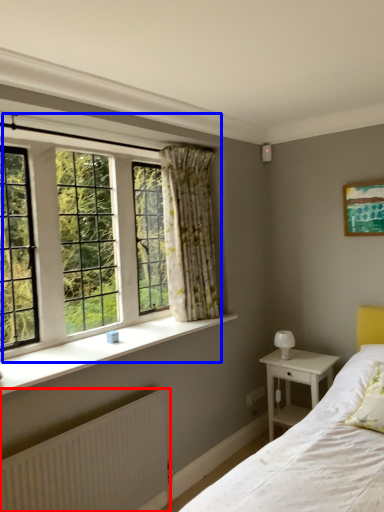
Question: Which of the following is the closest to the observer, radiator (highlighted by a red box) or window (highlighted by a blue box)?

Choices:
 (A) radiator
 (B) window

Answer: (A)